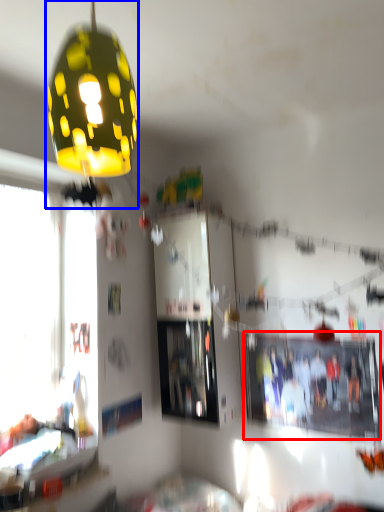
Question: Among these objects, which one is farthest to the camera, bulletin board (highlighted by a red box) or lamp (highlighted by a blue box)?

Choices:
 (A) bulletin board
 (B) lamp

Answer: (A)